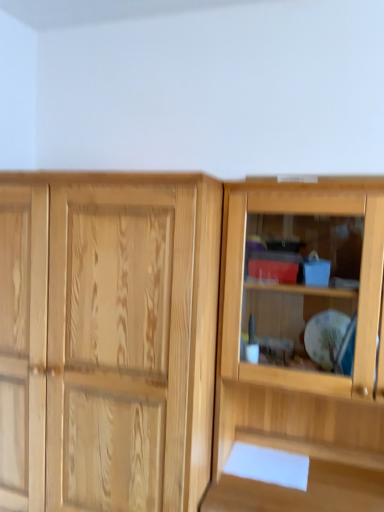
Question: Based on their sizes in the image, would you say natural wood cupboard at right is bigger or smaller than natural wood cabinet at left?

Choices:
 (A) small
 (B) big

Answer: (A)

Question: From a real-world perspective, is natural wood cupboard at right physically located above or below natural wood cabinet at left?

Choices:
 (A) above
 (B) below

Answer: (A)

Question: Looking at their shapes, would you say natural wood cupboard at right is wider or thinner than natural wood cabinet at left?

Choices:
 (A) wide
 (B) thin

Answer: (B)

Question: Is natural wood cabinet at left wider or thinner than natural wood cupboard at right?

Choices:
 (A) wide
 (B) thin

Answer: (A)

Question: In the image, is natural wood cabinet at left positioned in front of or behind natural wood cupboard at right?

Choices:
 (A) front
 (B) behind

Answer: (B)

Question: From the image's perspective, is natural wood cabinet at left positioned above or below natural wood cupboard at right?

Choices:
 (A) below
 (B) above

Answer: (A)

Question: From a real-world perspective, relative to natural wood cupboard at right, is natural wood cabinet at left vertically above or below?

Choices:
 (A) below
 (B) above

Answer: (A)